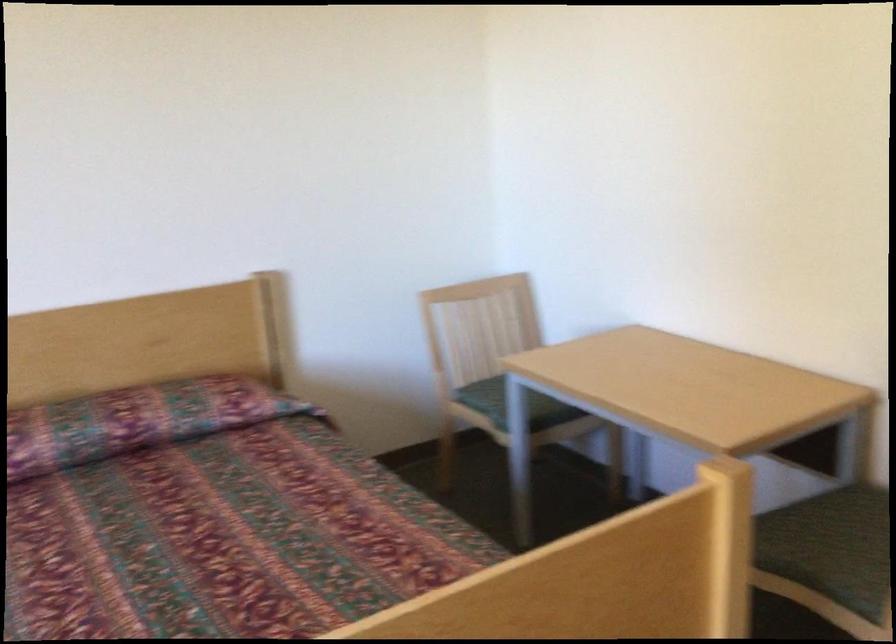
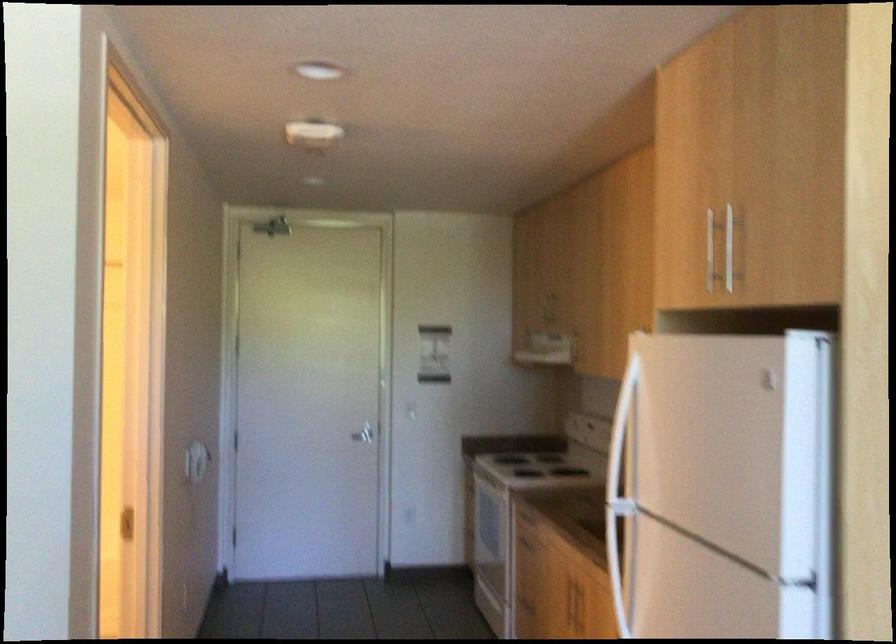
Question: The first image is from the beginning of the video and the second image is from the end. How did the camera likely rotate when shooting the video?

Choices:
 (A) Left
 (B) Right
 (C) Up
 (D) Down

Answer: (B)